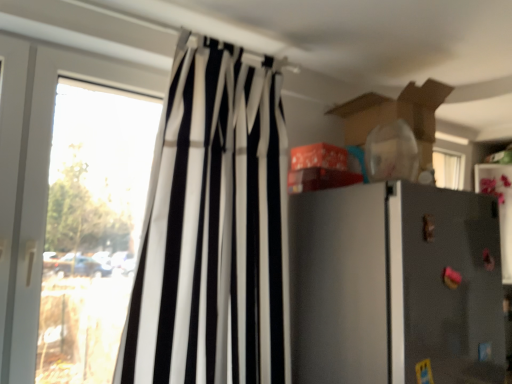
Question: Considering the positions of transparent glass window at left and black/white striped curtain at left in the image, is transparent glass window at left bigger or smaller than black/white striped curtain at left?

Choices:
 (A) big
 (B) small

Answer: (B)

Question: From a real-world perspective, relative to black/white striped curtain at left, is transparent glass window at left vertically above or below?

Choices:
 (A) above
 (B) below

Answer: (B)

Question: Estimate the real-world distances between objects in this image. Which object is closer to the transparent glass window at left?

Choices:
 (A) black/white striped curtain at left
 (B) metallic gray refrigerator at right

Answer: (A)

Question: Which object is positioned farthest from the metallic gray refrigerator at right?

Choices:
 (A) transparent glass window at left
 (B) black/white striped curtain at left

Answer: (A)